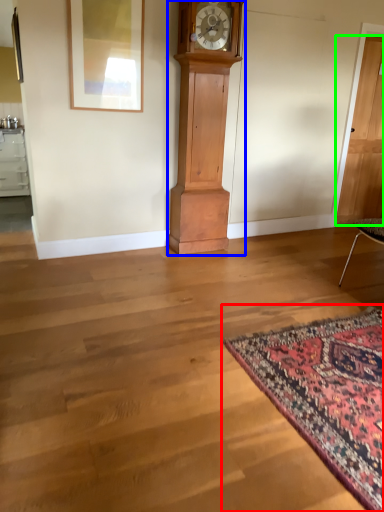
Question: Which object is positioned farthest from mat (highlighted by a red box)? Select from furniture (highlighted by a blue box) and door (highlighted by a green box).

Choices:
 (A) furniture
 (B) door

Answer: (B)